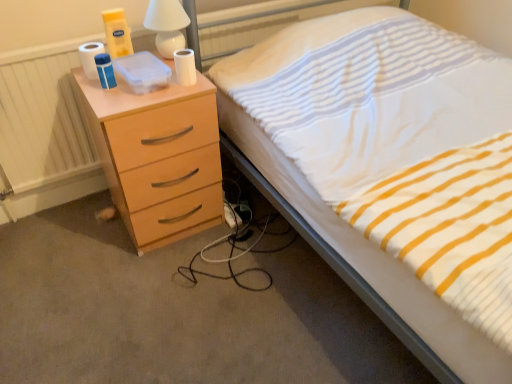
Identify the location of vacant area situated to the left side of white matte toilet paper at upper center, positioned as the second toilet paper in left-to-right order. This screenshot has height=384, width=512. (146, 89).